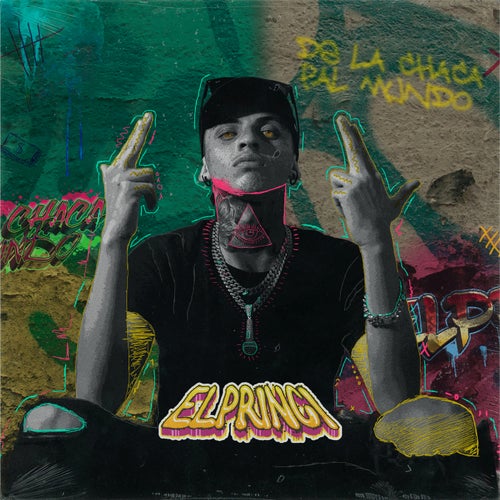
Locate an element on the screen. This screenshot has height=500, width=500. wall is located at coordinates (440, 147).